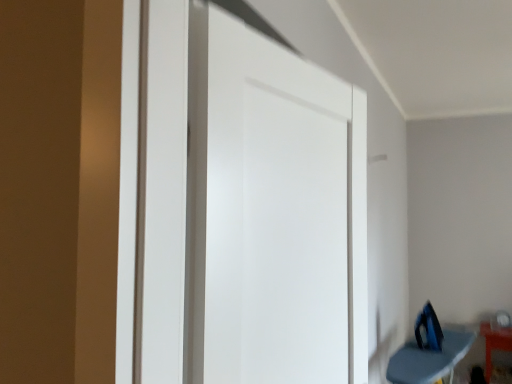
Question: Is blue fabric ironing board at lower right, the first furniture from the left, positioned before orange glossy table at lower right, positioned as the 2th furniture in front-to-back order?

Choices:
 (A) yes
 (B) no

Answer: (A)

Question: Is blue fabric ironing board at lower right, which ranks as the second furniture in back-to-front order, thinner than orange glossy table at lower right, positioned as the 2th furniture in left-to-right order?

Choices:
 (A) no
 (B) yes

Answer: (A)

Question: Is blue fabric ironing board at lower right, which ranks as the second furniture in back-to-front order, not within orange glossy table at lower right, positioned as the 2th furniture in left-to-right order?

Choices:
 (A) yes
 (B) no

Answer: (A)

Question: From a real-world perspective, is blue fabric ironing board at lower right, positioned as the second furniture in right-to-left order, beneath orange glossy table at lower right, which is the 1th furniture from back to front?

Choices:
 (A) no
 (B) yes

Answer: (A)

Question: Is blue fabric ironing board at lower right, positioned as the second furniture in right-to-left order, turned away from orange glossy table at lower right, which is the 1th furniture from back to front?

Choices:
 (A) yes
 (B) no

Answer: (B)

Question: Considering their positions, is orange glossy table at lower right, positioned as the 2th furniture in left-to-right order, located in front of or behind white matte door at center?

Choices:
 (A) front
 (B) behind

Answer: (B)

Question: From the image's perspective, is orange glossy table at lower right, the first furniture positioned from the right, located above or below white matte door at center?

Choices:
 (A) below
 (B) above

Answer: (A)

Question: Considering the positions of orange glossy table at lower right, positioned as the 2th furniture in front-to-back order, and white matte door at center in the image, is orange glossy table at lower right, positioned as the 2th furniture in front-to-back order, taller or shorter than white matte door at center?

Choices:
 (A) tall
 (B) short

Answer: (B)

Question: Is orange glossy table at lower right, positioned as the 2th furniture in left-to-right order, bigger or smaller than white matte door at center?

Choices:
 (A) big
 (B) small

Answer: (B)

Question: In the image, is blue fabric ironing board at lower right, acting as the first furniture starting from the front, positioned in front of or behind blue plastic iron at lower right?

Choices:
 (A) front
 (B) behind

Answer: (A)

Question: Considering the positions of point (414, 380) and point (418, 337), is point (414, 380) closer or farther from the camera than point (418, 337)?

Choices:
 (A) farther
 (B) closer

Answer: (B)

Question: Looking at their shapes, would you say blue fabric ironing board at lower right, which ranks as the second furniture in back-to-front order, is wider or thinner than blue plastic iron at lower right?

Choices:
 (A) thin
 (B) wide

Answer: (B)

Question: From the image's perspective, relative to blue plastic iron at lower right, is blue fabric ironing board at lower right, the first furniture from the left, above or below?

Choices:
 (A) above
 (B) below

Answer: (B)

Question: From a real-world perspective, is blue fabric ironing board at lower right, the first furniture from the left, physically located above or below orange glossy table at lower right, which is the 1th furniture from back to front?

Choices:
 (A) above
 (B) below

Answer: (A)

Question: Looking at the image, does blue fabric ironing board at lower right, the first furniture from the left, seem bigger or smaller compared to orange glossy table at lower right, positioned as the 2th furniture in left-to-right order?

Choices:
 (A) big
 (B) small

Answer: (A)